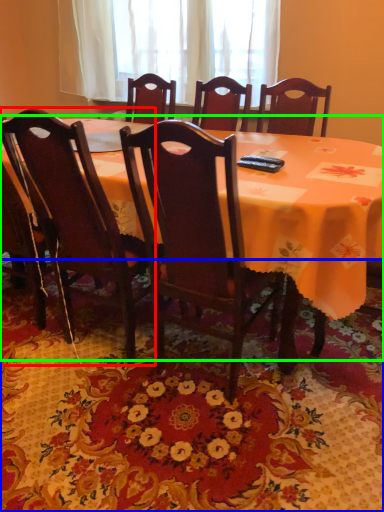
Question: Estimate the real-world distances between objects in this image. Which object is closer to chair (highlighted by a red box), mat (highlighted by a blue box) or table (highlighted by a green box)?

Choices:
 (A) mat
 (B) table

Answer: (A)